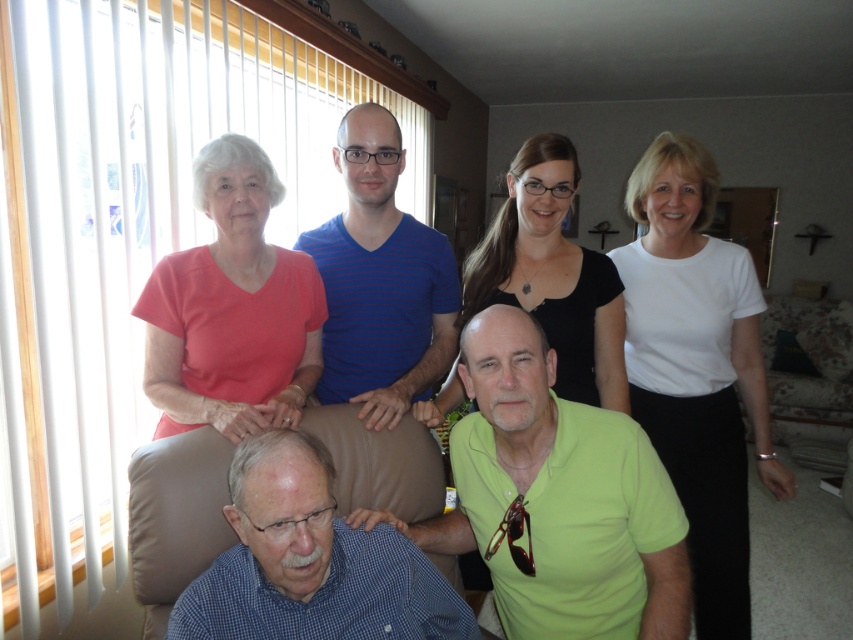
Who is taller, blue striped shirt at center or matte green shirt at center?

matte green shirt at center

Does blue striped shirt at center have a lesser height compared to matte green shirt at center?

Correct, blue striped shirt at center is not as tall as matte green shirt at center.

Is point (416, 400) positioned in front of point (202, 468)?

No.

Where is `blue striped shirt at center`? This screenshot has width=853, height=640. blue striped shirt at center is located at coordinates (380, 282).

Who is positioned more to the right, blue checkered shirt at lower left or blue striped shirt at center?

From the viewer's perspective, blue striped shirt at center appears more on the right side.

The width and height of the screenshot is (853, 640). Find the location of `blue checkered shirt at lower left`. blue checkered shirt at lower left is located at coordinates (310, 561).

Can you confirm if white smooth shirt at upper right is positioned to the left of matte green shirt at center?

Indeed, white smooth shirt at upper right is positioned on the left side of matte green shirt at center.

Between point (654, 205) and point (155, 506), which one is positioned in front?

Point (155, 506) is in front.

Is point (695, 547) closer to viewer compared to point (581, 380)?

No, it is not.

Identify the location of white smooth shirt at upper right. (697, 369).